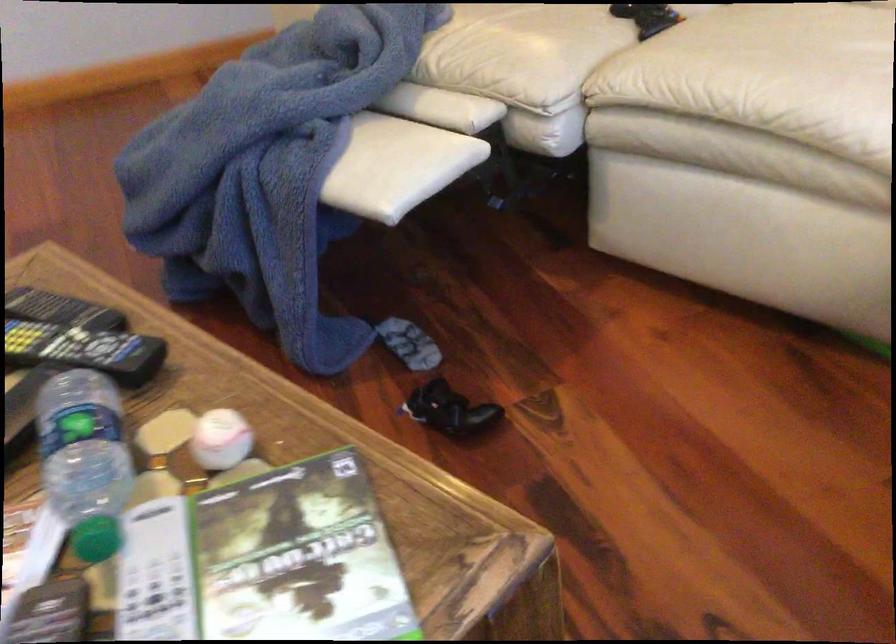
Where would you sit the white sofa sitting surface? Please return your answer as a coordinate pair (x, y).

(524, 51)